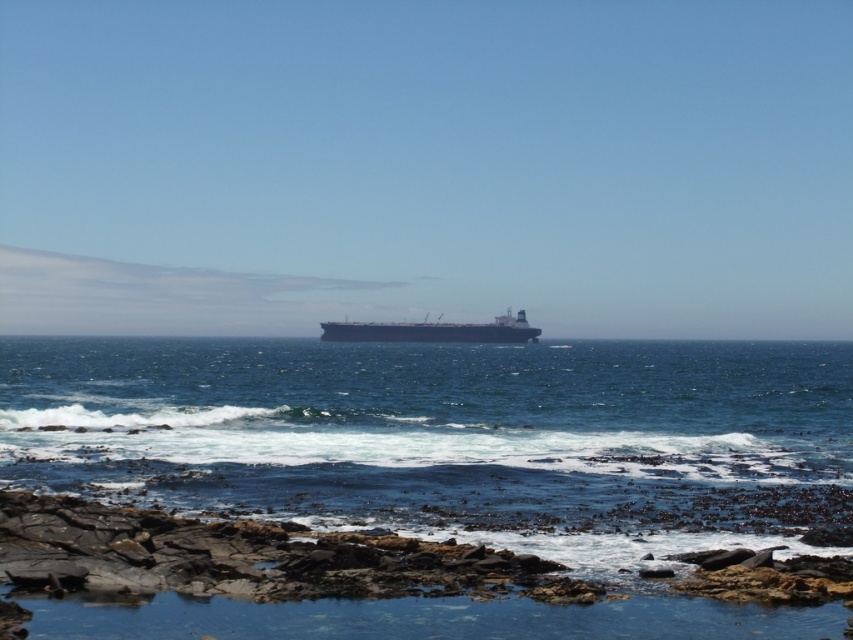
Between point (680, 522) and point (515, 336), which one is positioned behind?

Point (515, 336)

Measure the distance between blue water at center and metallic gray ship at center.

40.43 meters

Is point (143, 360) positioned behind point (320, 339)?

No, (143, 360) is closer to viewer.

This screenshot has width=853, height=640. Identify the location of blue water at center. (445, 465).